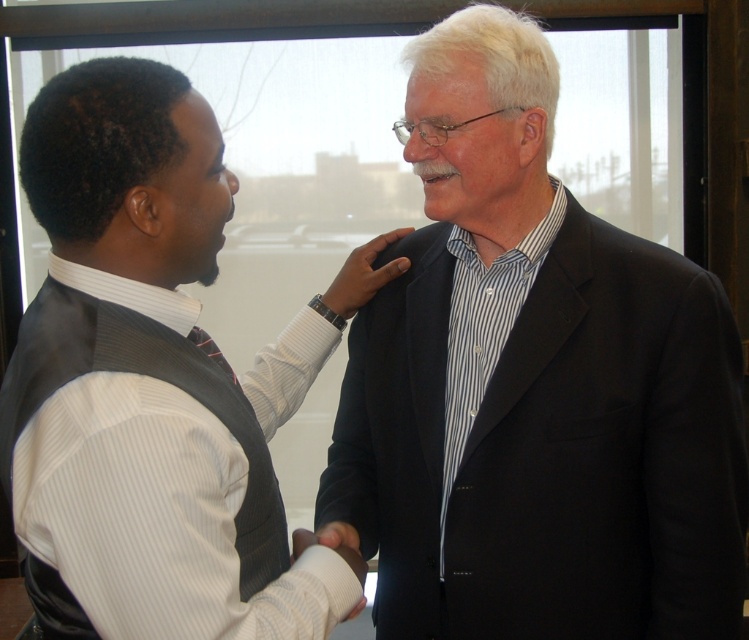
Describe the element at coordinates (148, 385) in the screenshot. The height and width of the screenshot is (640, 749). I see `white striped shirt at upper left` at that location.

Does point (73, 74) come farther from viewer compared to point (357, 611)?

That is False.

Which is in front, point (82, 205) or point (300, 540)?

Point (82, 205)

Locate an element on the screen. white striped shirt at upper left is located at coordinates (148, 385).

Is black matte suit at center closer to camera compared to white fabric hand at center?

No, black matte suit at center is behind white fabric hand at center.

Is black matte suit at center to the left of white fabric hand at center from the viewer's perspective?

In fact, black matte suit at center is to the right of white fabric hand at center.

Locate an element on the screen. Image resolution: width=749 pixels, height=640 pixels. black matte suit at center is located at coordinates (539, 403).

Locate an element on the screen. This screenshot has height=640, width=749. black matte suit at center is located at coordinates (539, 403).

Who is lower down, black leather hand at center or white fabric hand at center?

white fabric hand at center is below.

Does point (369, 282) come farther from viewer compared to point (294, 556)?

Yes, point (369, 282) is farther from viewer.

Who is more forward, (366, 253) or (312, 540)?

Positioned in front is point (312, 540).

The image size is (749, 640). What are the coordinates of `black leather hand at center` in the screenshot? It's located at (363, 275).